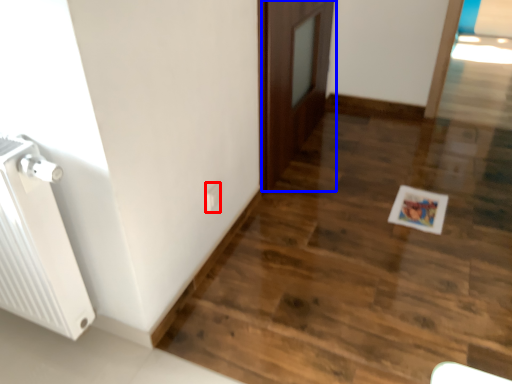
Question: Which of the following is the farthest to the observer, electric outlet (highlighted by a red box) or door (highlighted by a blue box)?

Choices:
 (A) electric outlet
 (B) door

Answer: (B)